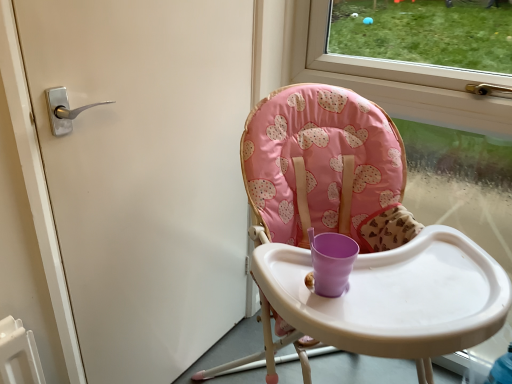
Question: Is matte silver handle at left to the right of pink fabric highchair at center from the viewer's perspective?

Choices:
 (A) no
 (B) yes

Answer: (A)

Question: Is matte silver handle at left not within pink fabric highchair at center?

Choices:
 (A) yes
 (B) no

Answer: (A)

Question: Is matte silver handle at left looking in the opposite direction of pink fabric highchair at center?

Choices:
 (A) yes
 (B) no

Answer: (A)

Question: Considering the relative sizes of matte silver handle at left and pink fabric highchair at center in the image provided, is matte silver handle at left shorter than pink fabric highchair at center?

Choices:
 (A) yes
 (B) no

Answer: (B)

Question: Does matte silver handle at left have a greater width compared to pink fabric highchair at center?

Choices:
 (A) yes
 (B) no

Answer: (B)

Question: Can you confirm if matte silver handle at left is smaller than pink fabric highchair at center?

Choices:
 (A) no
 (B) yes

Answer: (B)

Question: From the image's perspective, is pink fabric highchair at center above matte silver handle at left?

Choices:
 (A) yes
 (B) no

Answer: (B)

Question: Is matte silver handle at left completely or partially inside pink fabric highchair at center?

Choices:
 (A) no
 (B) yes

Answer: (A)

Question: From the image's perspective, would you say pink fabric highchair at center is shown under matte silver handle at left?

Choices:
 (A) no
 (B) yes

Answer: (B)

Question: From a real-world perspective, is pink fabric highchair at center over matte silver handle at left?

Choices:
 (A) yes
 (B) no

Answer: (B)

Question: Is pink fabric highchair at center smaller than matte silver handle at left?

Choices:
 (A) no
 (B) yes

Answer: (A)

Question: Can you confirm if pink fabric highchair at center is shorter than matte silver handle at left?

Choices:
 (A) yes
 (B) no

Answer: (A)

Question: Based on their positions, is matte silver handle at left located to the left or right of pink fabric highchair at center?

Choices:
 (A) right
 (B) left

Answer: (B)